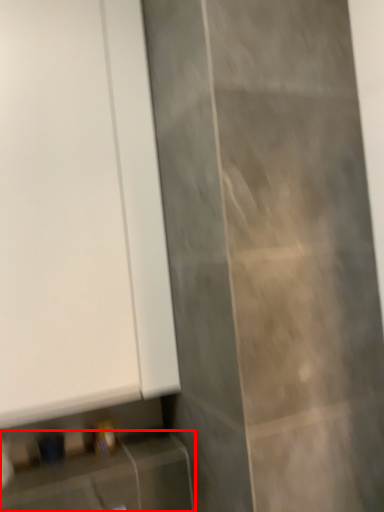
Question: From the image's perspective, considering the relative positions of cabinetry (annotated by the red box) and door in the image provided, where is cabinetry (annotated by the red box) located with respect to the staircase?

Choices:
 (A) above
 (B) below

Answer: (B)